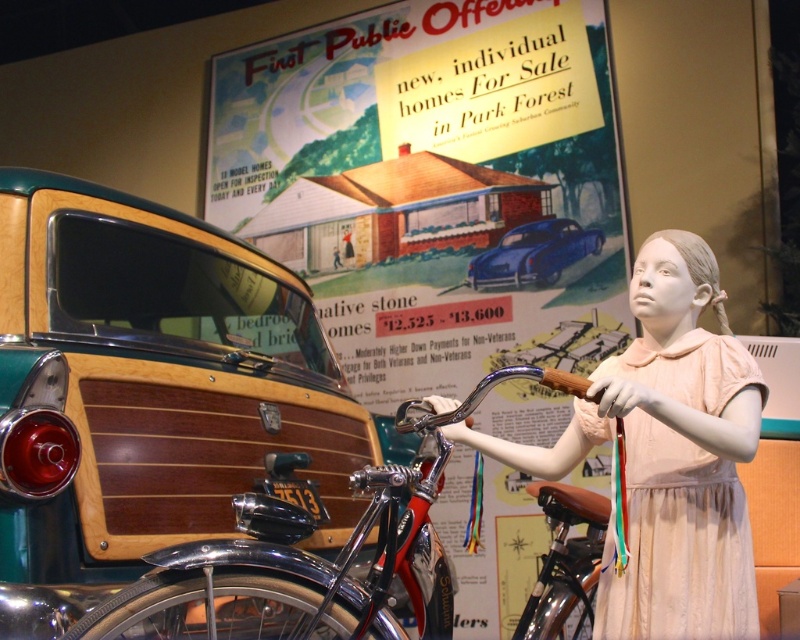
Which is below, wooden signboard at center or wooden paneling at left?

wooden paneling at left

Is point (428, 282) positioned in front of point (272, 285)?

No, (428, 282) is further to viewer.

This screenshot has height=640, width=800. Identify the location of wooden signboard at center. (429, 182).

Between wooden paneling at left and shiny blue car at center, which one is positioned higher?

shiny blue car at center is higher up.

Who is lower down, wooden paneling at left or shiny blue car at center?

wooden paneling at left is below.

Is point (32, 484) closer to camera compared to point (566, 228)?

Yes, point (32, 484) is closer to viewer.

At what (x,y) coordinates should I click in order to perform the action: click on wooden paneling at left. Please return your answer as a coordinate pair (x, y). This screenshot has height=640, width=800. Looking at the image, I should click on (150, 394).

Is wooden signboard at center shorter than shiny blue car at center?

Incorrect, wooden signboard at center's height does not fall short of shiny blue car at center's.

Which of these two, wooden signboard at center or shiny blue car at center, stands taller?

With more height is wooden signboard at center.

What do you see at coordinates (429, 182) in the screenshot? The image size is (800, 640). I see `wooden signboard at center` at bounding box center [429, 182].

Image resolution: width=800 pixels, height=640 pixels. In order to click on wooden signboard at center in this screenshot , I will do `click(429, 182)`.